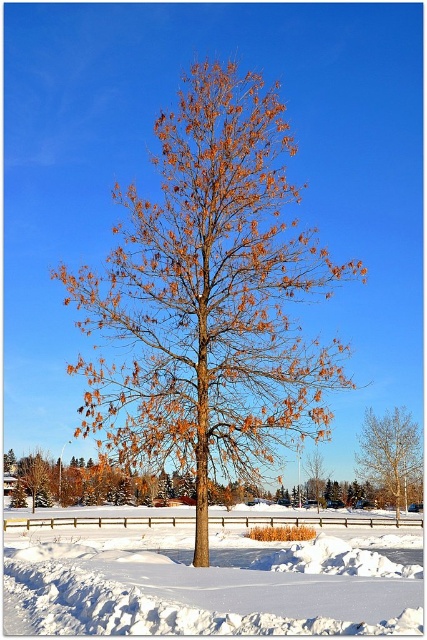
Does brown matte tree at center appear on the right side of golden-brown bark tree at center?

In fact, brown matte tree at center is to the left of golden-brown bark tree at center.

Does brown matte tree at center appear over golden-brown bark tree at center?

Yes, brown matte tree at center is above golden-brown bark tree at center.

Between point (319, 429) and point (356, 458), which one is positioned in front?

Point (319, 429)

At what (x,y) coordinates should I click in order to perform the action: click on brown matte tree at center. Please return your answer as a coordinate pair (x, y). The width and height of the screenshot is (427, 640). Looking at the image, I should click on (210, 298).

Does brown matte tree at center have a smaller size compared to white fluffy snow at center?

Indeed, brown matte tree at center has a smaller size compared to white fluffy snow at center.

Can you confirm if brown matte tree at center is shorter than white fluffy snow at center?

No.

Is point (98, 412) positioned after point (403, 554)?

No, it is not.

I want to click on brown matte tree at center, so click(x=210, y=298).

Who is positioned more to the left, white fluffy snow at center or golden-brown bark tree at center?

From the viewer's perspective, white fluffy snow at center appears more on the left side.

Which is more to the right, white fluffy snow at center or golden-brown bark tree at center?

Positioned to the right is golden-brown bark tree at center.

Is point (345, 621) positioned behind point (371, 477)?

No, (345, 621) is closer to viewer.

What are the coordinates of `white fluffy snow at center` in the screenshot? It's located at (213, 577).